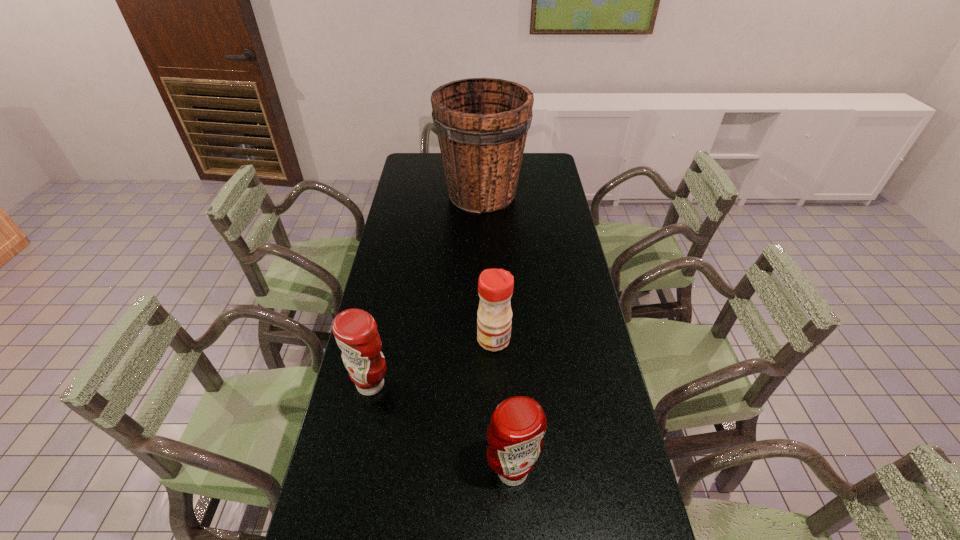
Locate an element on the screen. Image resolution: width=960 pixels, height=540 pixels. the tallest object is located at coordinates (482, 123).

Identify the location of the farthest object. (482, 123).

The height and width of the screenshot is (540, 960). I want to click on the second farthest object, so click(x=495, y=286).

This screenshot has width=960, height=540. Identify the location of the leftmost object. (355, 330).

In order to click on the third farthest object in this screenshot , I will do `click(355, 330)`.

Where is `the nearest condiment`? The image size is (960, 540). the nearest condiment is located at coordinates (518, 424).

Where is `free space located on the back of the tallest object`? This screenshot has height=540, width=960. free space located on the back of the tallest object is located at coordinates (482, 164).

I want to click on free location located 0.180m on the right of the third nearest object, so click(x=569, y=340).

Where is `free space located 0.200m on the right of the leftmost condiment`? The image size is (960, 540). free space located 0.200m on the right of the leftmost condiment is located at coordinates (464, 384).

I want to click on free region located on the front of the nearest object, so click(x=516, y=535).